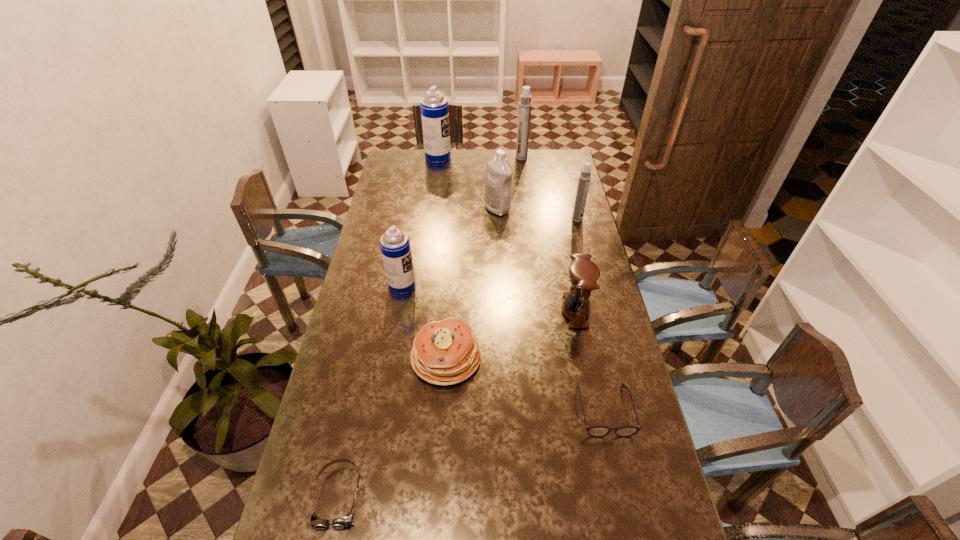
At what (x,y) coordinates should I click in order to perform the action: click on the bigger blue aerosol can. Please return your answer as a coordinate pair (x, y). This screenshot has width=960, height=540. Looking at the image, I should click on (434, 108).

Locate an element on the screen. The image size is (960, 540). the farther white aerosol can is located at coordinates (524, 112).

What are the coordinates of `the bigger white aerosol can` in the screenshot? It's located at (524, 112).

Find the location of `detergent`. detergent is located at coordinates (497, 196).

At what (x,y) coordinates should I click in order to perform the action: click on the fifth object from left to right. Please return your answer as a coordinate pair (x, y). The height and width of the screenshot is (540, 960). Looking at the image, I should click on (497, 196).

Image resolution: width=960 pixels, height=540 pixels. Identify the location of the smaller blue aerosol can. (395, 247).

This screenshot has height=540, width=960. I want to click on the nearest aerosol can, so click(x=395, y=247).

What are the coordinates of `the right white aerosol can` in the screenshot? It's located at (584, 178).

The height and width of the screenshot is (540, 960). Find the location of `the nearer white aerosol can`. the nearer white aerosol can is located at coordinates (584, 178).

The image size is (960, 540). What are the coordinates of `hourglass` in the screenshot? It's located at tap(583, 274).